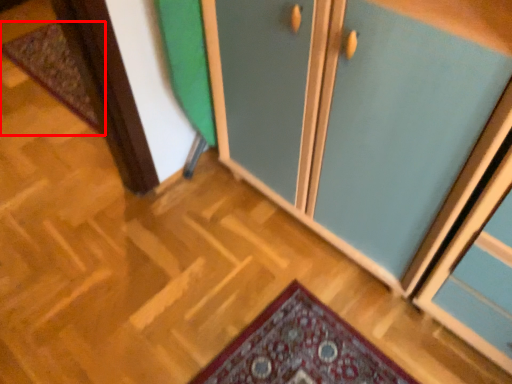
Question: Considering the relative positions of mat (annotated by the red box) and cupboard in the image provided, where is mat (annotated by the red box) located with respect to the staircase?

Choices:
 (A) left
 (B) right

Answer: (A)